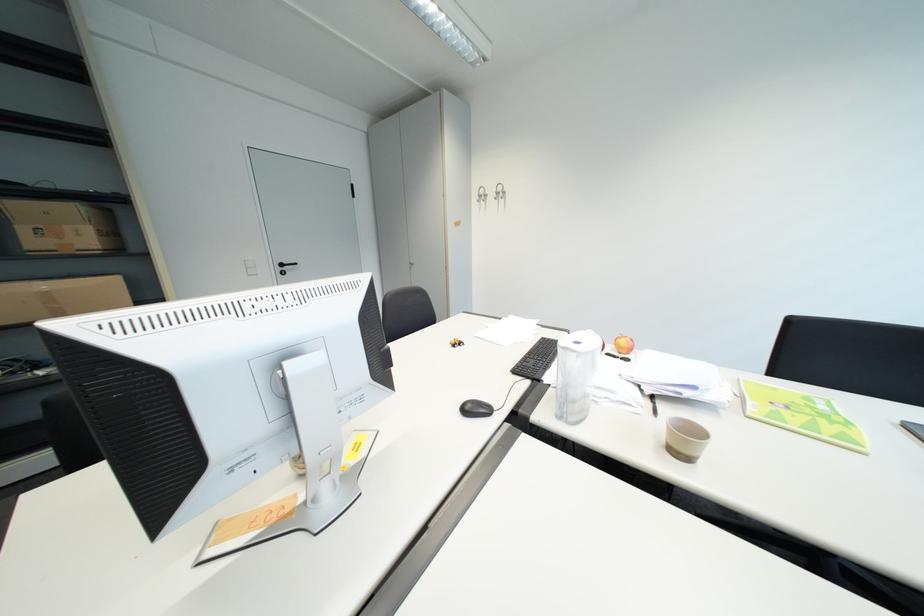
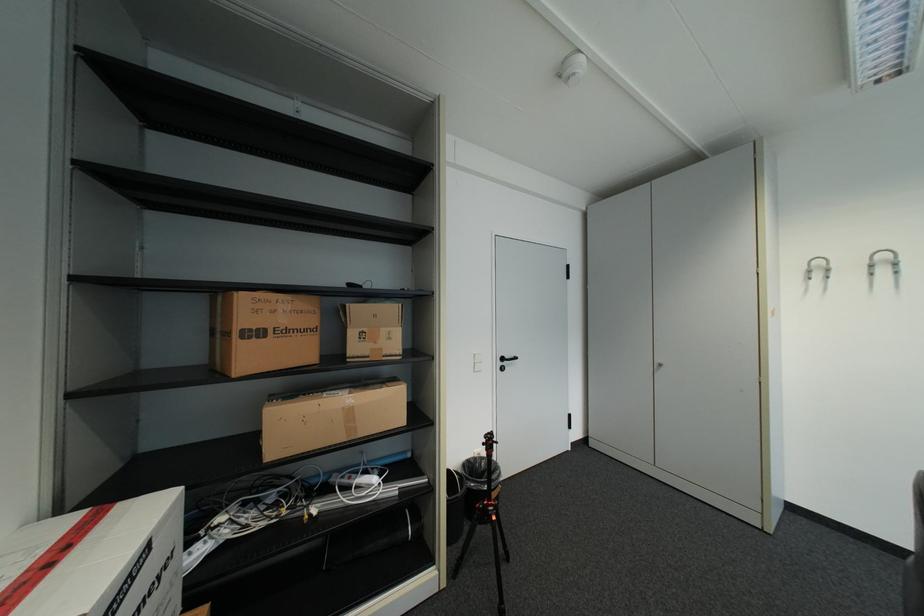
Question: Which direction would the cameraman need to move to produce the second image? Reply with the corresponding letter.

Choices:
 (A) Left
 (B) Right
 (C) Forward
 (D) Backward

Answer: (A)